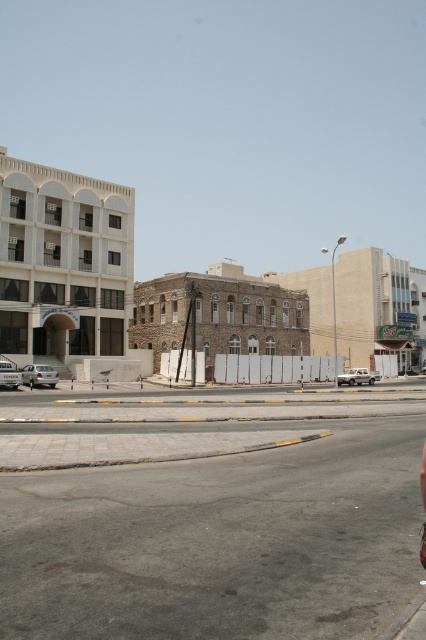
This screenshot has height=640, width=426. What are the coordinates of `white matte building at upper left` in the screenshot? It's located at (63, 262).

Which is behind, point (121, 342) or point (192, 308)?

The point (192, 308) is more distant.

Does point (48, 204) come behind point (233, 342)?

That is False.

Locate an element on the screen. white matte building at upper left is located at coordinates (63, 262).

Is point (259, 346) less distant than point (371, 353)?

Yes, it is in front of point (371, 353).

Measure the distance between brown stone building at center and beige stone building at center.

47.49 feet

Image resolution: width=426 pixels, height=640 pixels. Describe the element at coordinates (218, 316) in the screenshot. I see `brown stone building at center` at that location.

The width and height of the screenshot is (426, 640). I want to click on brown stone building at center, so click(218, 316).